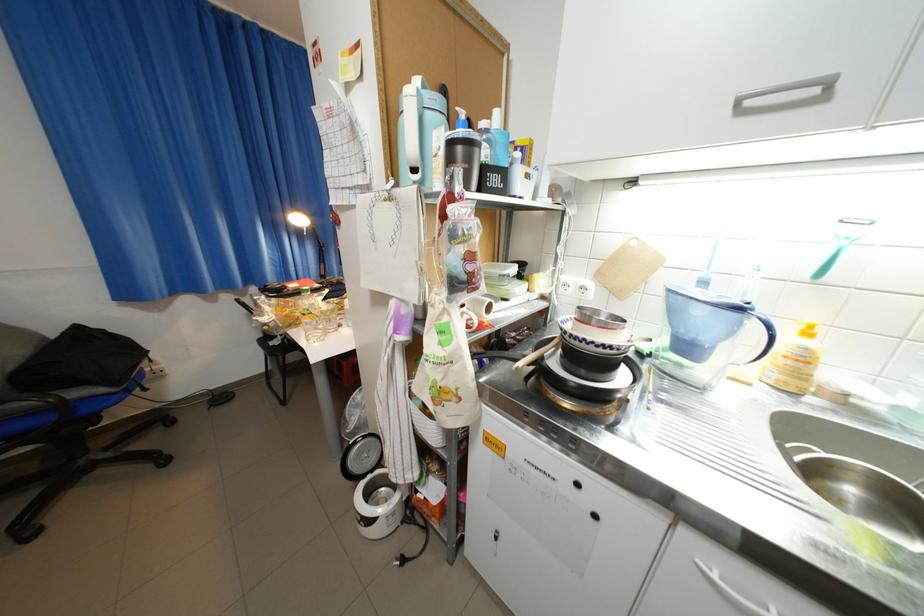
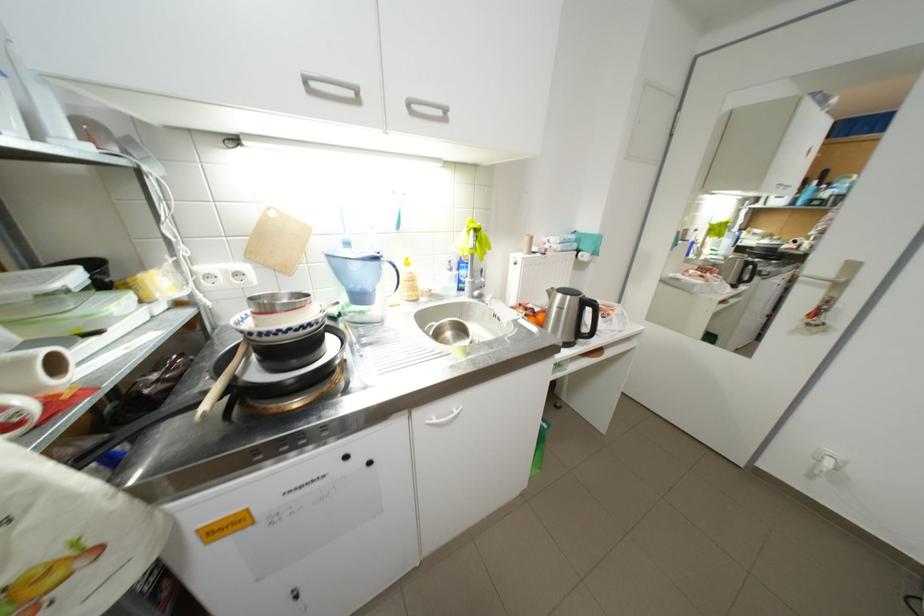
Question: I am providing you with two images of the same scene from different viewpoints. Please identify which objects are invisible in image2.

Choices:
 (A) faucet handle
 (B) yellow pump dispenser
 (C) silver door handle
 (D) none of these

Answer: (D)